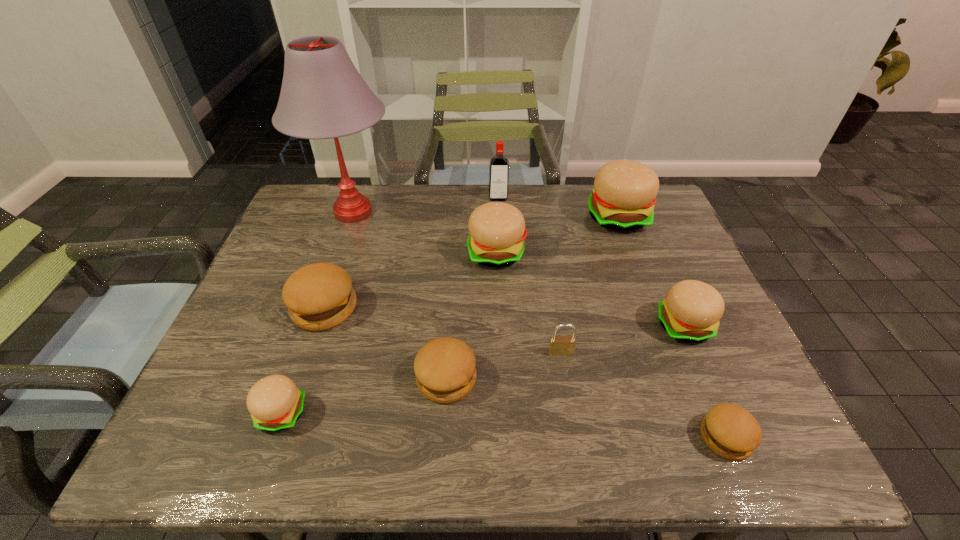
Where is `light table lamp`? light table lamp is located at coordinates (323, 96).

Find the location of a particular element. Image resolution: width=960 pixels, height=540 pixels. the tallest object is located at coordinates (323, 96).

Identify the location of red vodka. (498, 189).

The width and height of the screenshot is (960, 540). In order to click on the eighth shortest object in this screenshot , I will do `click(624, 194)`.

Locate an element on the screen. The image size is (960, 540). the biggest beige hamburger is located at coordinates (624, 194).

Locate an element on the screen. This screenshot has height=540, width=960. the seventh shortest object is located at coordinates tap(497, 230).

Identify the location of the second tallest hamburger. The image size is (960, 540). (497, 230).

Find the location of a particular element. The width and height of the screenshot is (960, 540). the second smallest beige hamburger is located at coordinates (691, 311).

This screenshot has height=540, width=960. Identify the location of the leftmost brown hamburger. (319, 296).

Where is `the biggest brown hamburger`? This screenshot has height=540, width=960. the biggest brown hamburger is located at coordinates pyautogui.click(x=319, y=296).